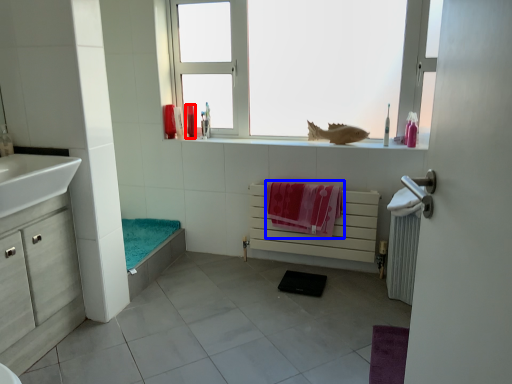
Question: Which of the following is the closest to the observer, toiletry (highlighted by a red box) or beach towel (highlighted by a blue box)?

Choices:
 (A) toiletry
 (B) beach towel

Answer: (B)